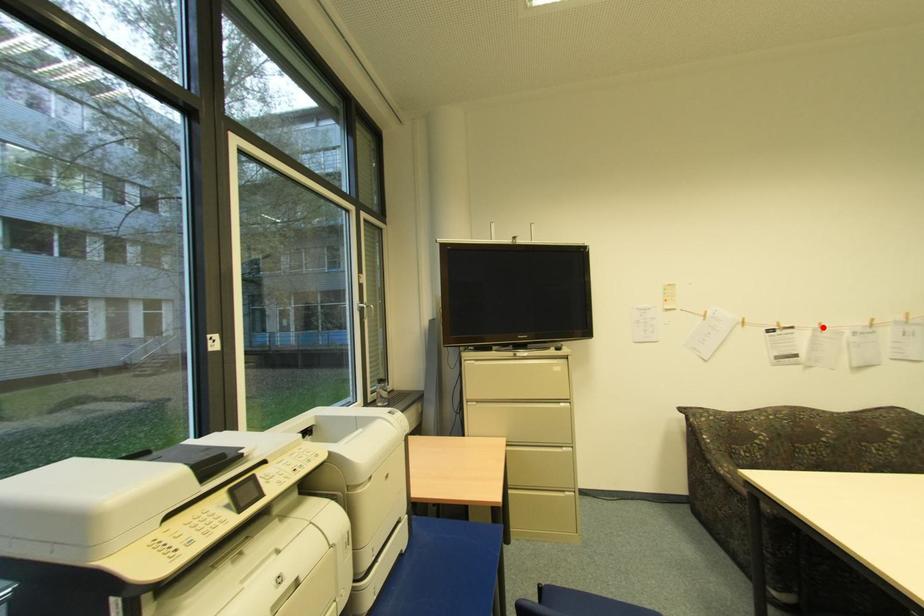
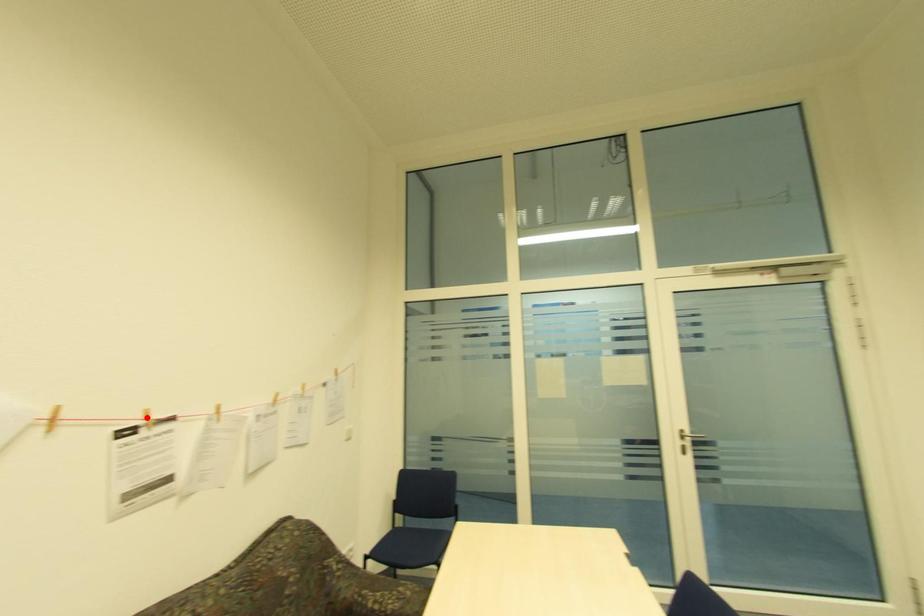
I am providing you with two images of the same scene from different viewpoints. A red point is marked on the first image and another point is marked on the second image. Do the highlighted points in image1 and image2 indicate the same real-world spot?

No